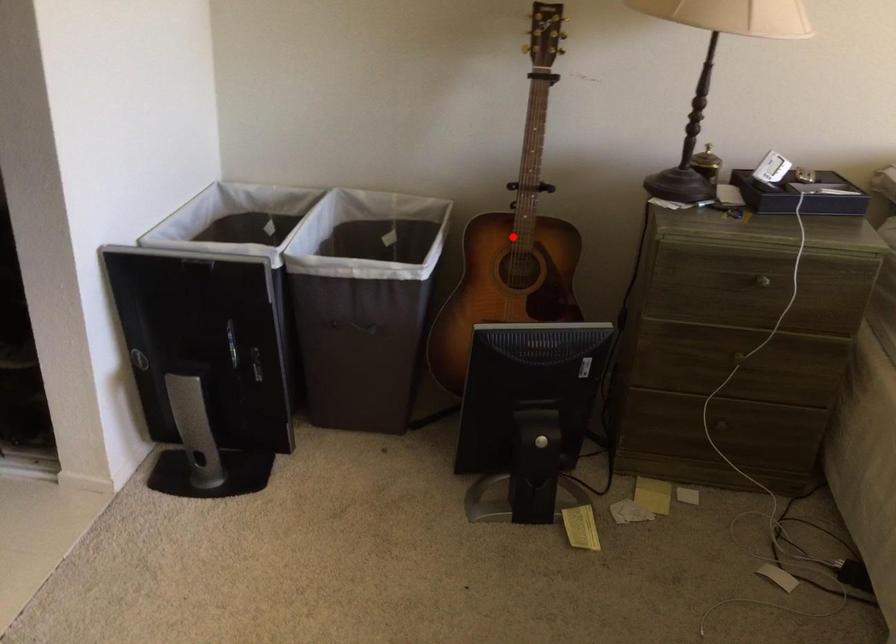
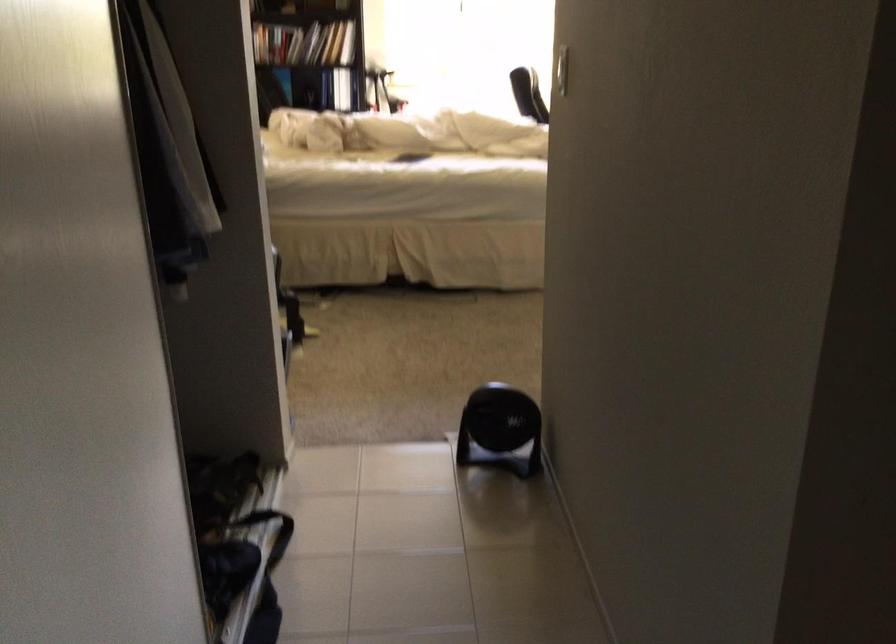
Question: I am providing you with two images of the same scene from different viewpoints. A red point is marked on the first image. Can you still see the location of the red point in image 2?

Choices:
 (A) Yes
 (B) No

Answer: (B)